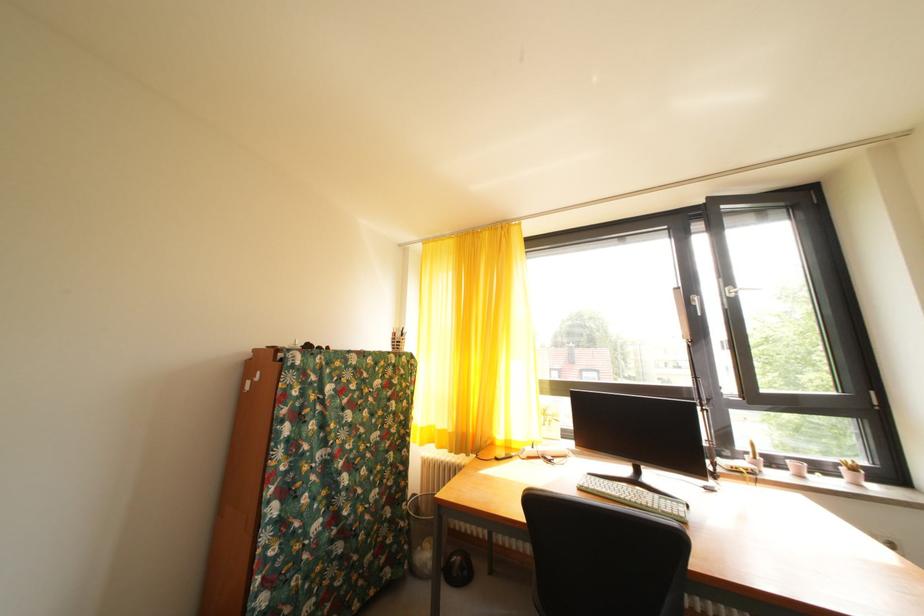
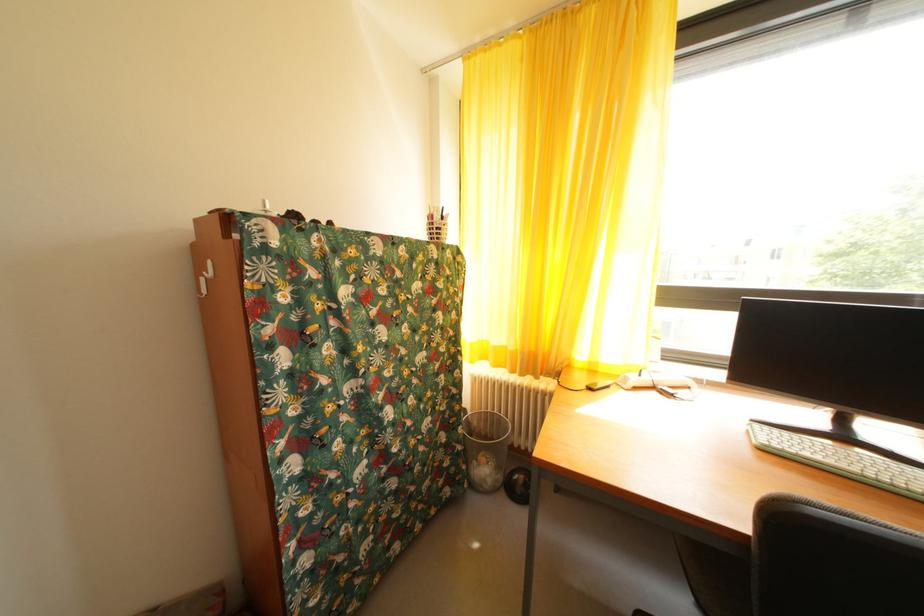
Find the pixel in the second image that matches (x=448, y=438) in the first image.

(505, 354)